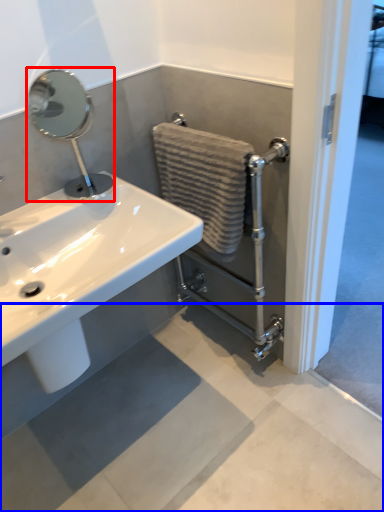
Question: Which point is further to the camera, plumbing fixture (highlighted by a red box) or concrete (highlighted by a blue box)?

Choices:
 (A) plumbing fixture
 (B) concrete

Answer: (A)